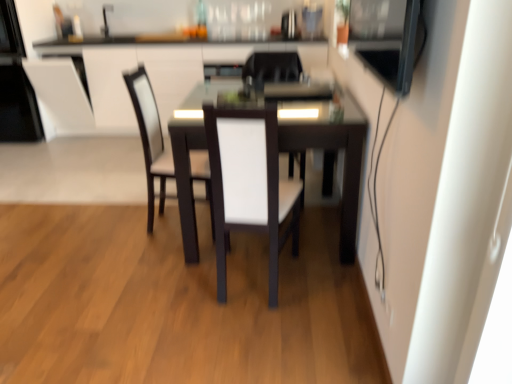
Question: Is white leather armchair at upper left behind dark wood table at center?

Choices:
 (A) yes
 (B) no

Answer: (A)

Question: Does white leather armchair at upper left have a larger size compared to dark wood table at center?

Choices:
 (A) yes
 (B) no

Answer: (B)

Question: Is white leather armchair at upper left oriented away from dark wood table at center?

Choices:
 (A) no
 (B) yes

Answer: (A)

Question: Is the surface of white leather armchair at upper left in direct contact with dark wood table at center?

Choices:
 (A) no
 (B) yes

Answer: (A)

Question: Does white leather armchair at upper left have a greater height compared to dark wood table at center?

Choices:
 (A) no
 (B) yes

Answer: (B)

Question: Can you confirm if white leather armchair at upper left is wider than dark wood table at center?

Choices:
 (A) yes
 (B) no

Answer: (B)

Question: Does metallic stainless steel microwave at upper right, the 1th appliance positioned from the front, come behind white fabric chair at center, the third chair in the front-to-back sequence?

Choices:
 (A) no
 (B) yes

Answer: (A)

Question: Considering the relative sizes of metallic stainless steel microwave at upper right, positioned as the 3th appliance in left-to-right order, and white fabric chair at center, the third chair in the front-to-back sequence, in the image provided, is metallic stainless steel microwave at upper right, positioned as the 3th appliance in left-to-right order, taller than white fabric chair at center, the third chair in the front-to-back sequence,?

Choices:
 (A) no
 (B) yes

Answer: (A)

Question: Could white fabric chair at center, marked as the 1th chair in a back-to-front arrangement, be considered to be inside metallic stainless steel microwave at upper right, which is the third appliance from back to front?

Choices:
 (A) yes
 (B) no

Answer: (B)

Question: Considering the relative positions of metallic stainless steel microwave at upper right, placed as the first appliance when sorted from right to left, and white fabric chair at center, marked as the 1th chair in a back-to-front arrangement, in the image provided, is metallic stainless steel microwave at upper right, placed as the first appliance when sorted from right to left, to the right of white fabric chair at center, marked as the 1th chair in a back-to-front arrangement, from the viewer's perspective?

Choices:
 (A) yes
 (B) no

Answer: (A)

Question: Could you tell me if metallic stainless steel microwave at upper right, which is the third appliance from back to front, is turned towards white fabric chair at center, marked as the 1th chair in a back-to-front arrangement?

Choices:
 (A) yes
 (B) no

Answer: (B)

Question: Is metallic stainless steel microwave at upper right, which is the third appliance from back to front, at the left side of white fabric chair at center, the third chair in the front-to-back sequence?

Choices:
 (A) no
 (B) yes

Answer: (A)

Question: From the image's perspective, is dark wood table at center beneath white leather chair at center, which is the second chair in back-to-front order?

Choices:
 (A) yes
 (B) no

Answer: (A)